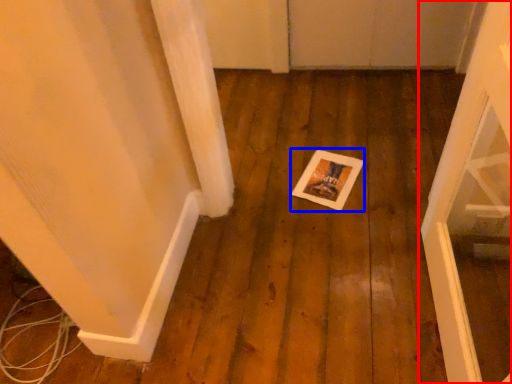
Question: Among these objects, which one is farthest to the camera, door (highlighted by a red box) or postcard (highlighted by a blue box)?

Choices:
 (A) door
 (B) postcard

Answer: (B)